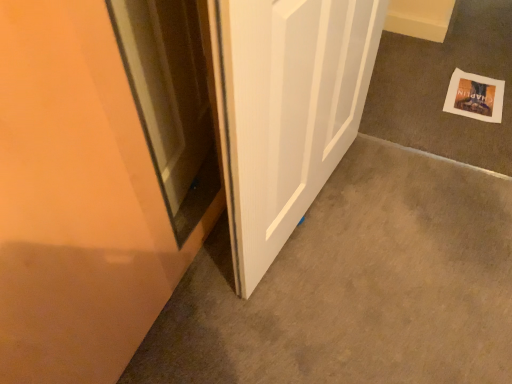
Question: From the image's perspective, is white paper at lower right below white wood door at center?

Choices:
 (A) yes
 (B) no

Answer: (B)

Question: Does white paper at lower right have a lesser width compared to white wood door at center?

Choices:
 (A) yes
 (B) no

Answer: (B)

Question: From the image's perspective, is white paper at lower right on white wood door at center?

Choices:
 (A) yes
 (B) no

Answer: (A)

Question: Considering the relative sizes of white paper at lower right and white wood door at center in the image provided, is white paper at lower right smaller than white wood door at center?

Choices:
 (A) yes
 (B) no

Answer: (A)

Question: Is white wood door at center a part of white paper at lower right?

Choices:
 (A) yes
 (B) no

Answer: (B)

Question: Is white paper at lower right looking in the opposite direction of white wood door at center?

Choices:
 (A) no
 (B) yes

Answer: (A)

Question: Is white wood door at center wider than white paper at lower right?

Choices:
 (A) no
 (B) yes

Answer: (A)

Question: From a real-world perspective, is white wood door at center beneath white paper at lower right?

Choices:
 (A) yes
 (B) no

Answer: (B)

Question: Can you confirm if white wood door at center is positioned to the right of white paper at lower right?

Choices:
 (A) no
 (B) yes

Answer: (A)

Question: Does white wood door at center have a lesser height compared to white paper at lower right?

Choices:
 (A) yes
 (B) no

Answer: (B)

Question: Are white wood door at center and white paper at lower right making contact?

Choices:
 (A) yes
 (B) no

Answer: (B)

Question: From the image's perspective, does white wood door at center appear higher than white paper at lower right?

Choices:
 (A) no
 (B) yes

Answer: (A)

Question: Considering the positions of white wood door at center and white paper at lower right in the image, is white wood door at center taller or shorter than white paper at lower right?

Choices:
 (A) tall
 (B) short

Answer: (A)